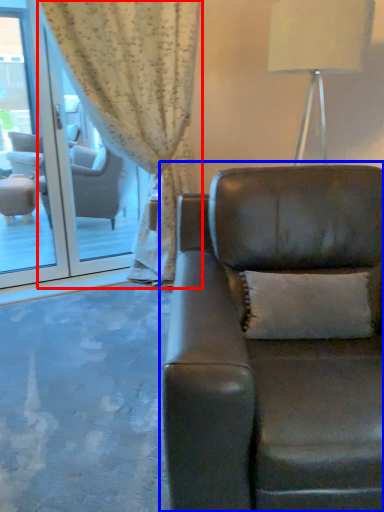
Question: Which of the following is the farthest to the observer, curtain (highlighted by a red box) or studio couch (highlighted by a blue box)?

Choices:
 (A) curtain
 (B) studio couch

Answer: (A)